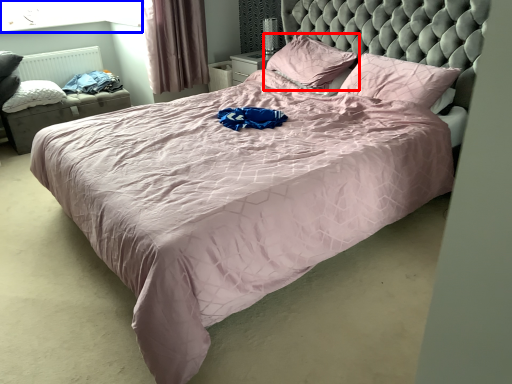
Question: Among these objects, which one is farthest to the camera, pillow (highlighted by a red box) or window screen (highlighted by a blue box)?

Choices:
 (A) pillow
 (B) window screen

Answer: (B)